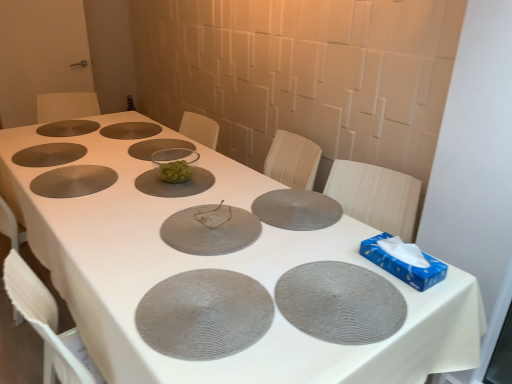
What are the coordinates of `empty space that is ontop of transparent glass bowl at center, the third glass plate positioned from the back (from a real-world perspective)` in the screenshot? It's located at (160, 143).